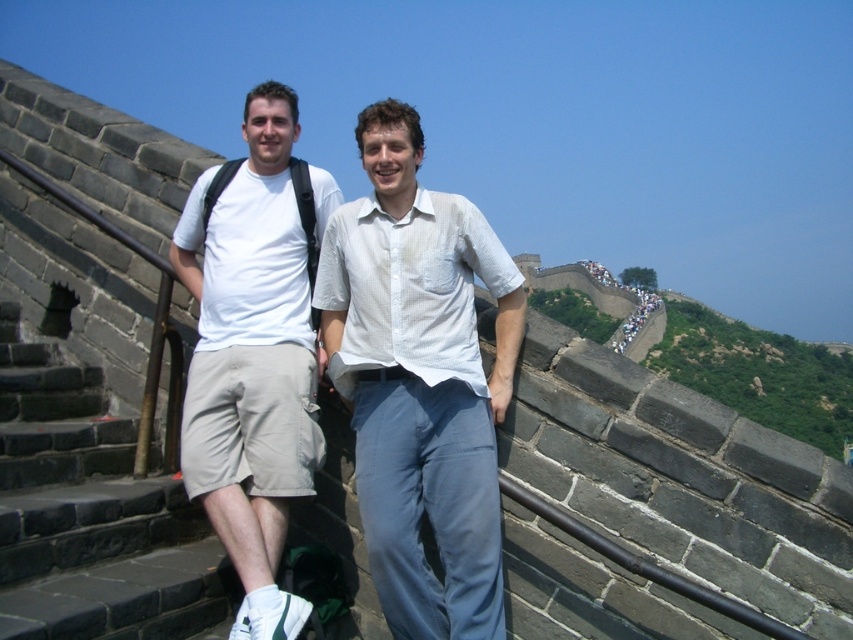
Is white cotton shirt at center bigger than white cotton t-shirt at center?

Indeed, white cotton shirt at center has a larger size compared to white cotton t-shirt at center.

Is point (270, 403) positioned after point (254, 129)?

No.

At what (x,y) coordinates should I click in order to perform the action: click on white cotton shirt at center. Please return your answer as a coordinate pair (x, y). The image size is (853, 640). Looking at the image, I should click on (257, 342).

This screenshot has height=640, width=853. Find the location of `white cotton shirt at center`. white cotton shirt at center is located at coordinates (257, 342).

Can you confirm if white cotton t-shirt at center is positioned below black stone stairs at lower left?

No.

Identify the location of white cotton t-shirt at center. (254, 349).

Locate an element on the screen. The image size is (853, 640). white cotton t-shirt at center is located at coordinates coord(254,349).

Does white cotton shirt at center have a greater width compared to black stone stairs at lower left?

Yes.

Image resolution: width=853 pixels, height=640 pixels. I want to click on white cotton shirt at center, so click(257, 342).

Identify the location of white cotton shirt at center. The image size is (853, 640). (257, 342).